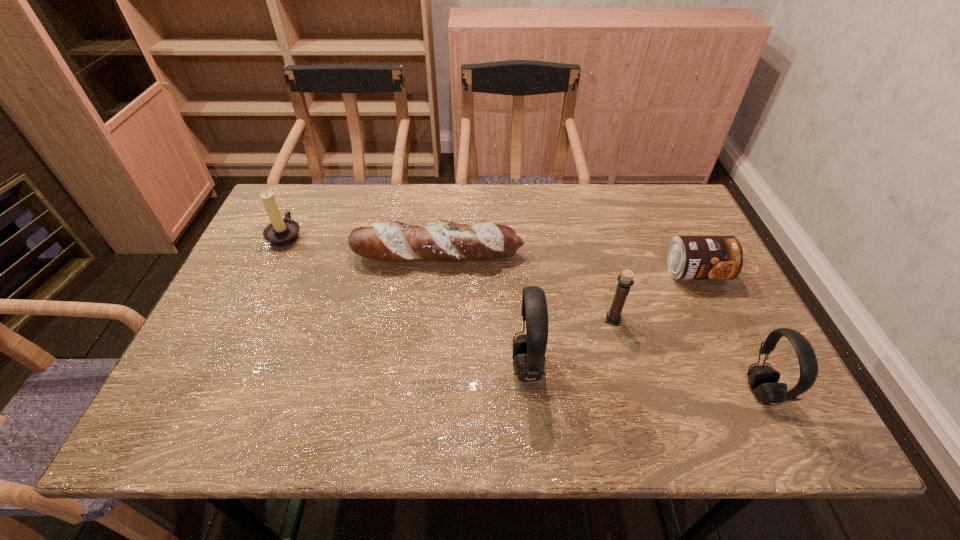
Find the location of a particular element. free location located on the front-facing side of the left headset is located at coordinates [364, 367].

This screenshot has width=960, height=540. I want to click on free space located 0.370m on the front-facing side of the left headset, so click(x=341, y=367).

This screenshot has width=960, height=540. Find the location of `free point located on the front-facing side of the shorter headset`. free point located on the front-facing side of the shorter headset is located at coordinates coord(666,392).

The width and height of the screenshot is (960, 540). I want to click on vacant point located on the front-facing side of the shorter headset, so click(x=636, y=392).

Locate an element on the screen. blank space located on the front-facing side of the shorter headset is located at coordinates (714, 392).

Locate an element on the screen. vacant space situated 0.150m on the front label of the can is located at coordinates (726, 337).

You are a GUI agent. You are given a task and a screenshot of the screen. Output one action in this format:
    pyautogui.click(x=<x>, y=<y>)
    Task: Click on the vacant area situated on the front of the baguet
    The height and width of the screenshot is (540, 960).
    Given the screenshot: What is the action you would take?
    pyautogui.click(x=424, y=387)

At what (x,y) coordinates should I click in order to perform the action: click on vacant area located on the wick of the left candle holder. Please return your answer as a coordinate pair (x, y). This screenshot has width=960, height=540. Looking at the image, I should click on (426, 235).

This screenshot has width=960, height=540. What are the coordinates of `vacant region located on the right of the fourth object from left to right` in the screenshot? It's located at (643, 319).

At what (x,y) coordinates should I click in order to perform the action: click on object that is positioned at the far edge. Please return your answer as a coordinate pair (x, y). The height and width of the screenshot is (540, 960). Looking at the image, I should click on (281, 232).